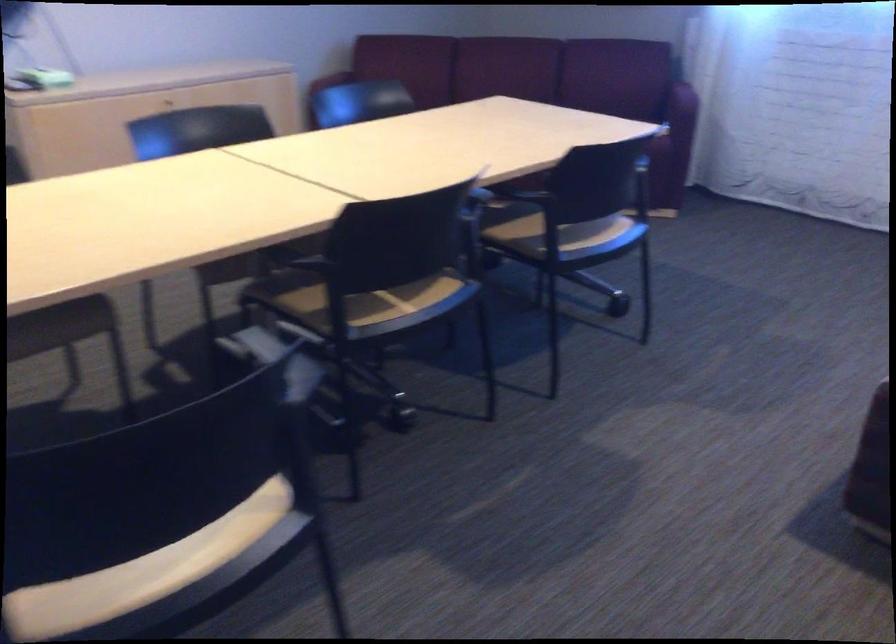
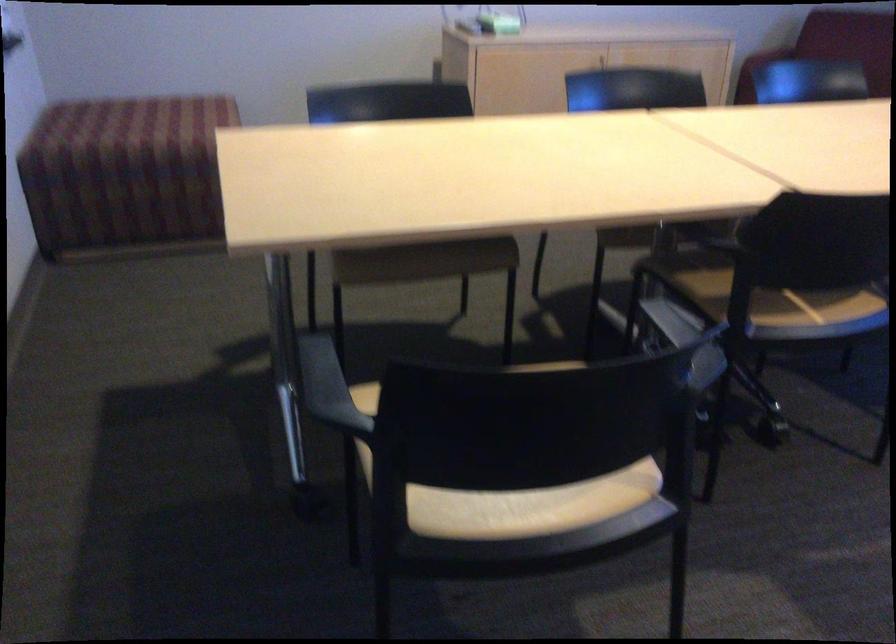
In the second image, find the point that corresponds to [395,288] in the first image.

(812, 301)